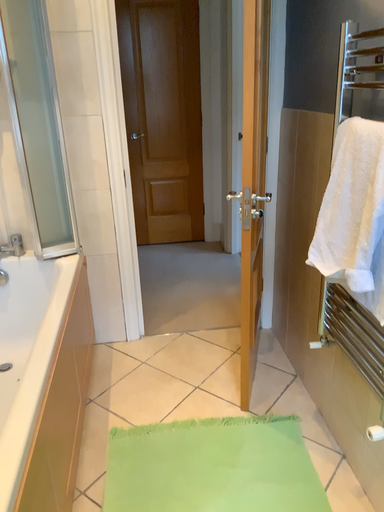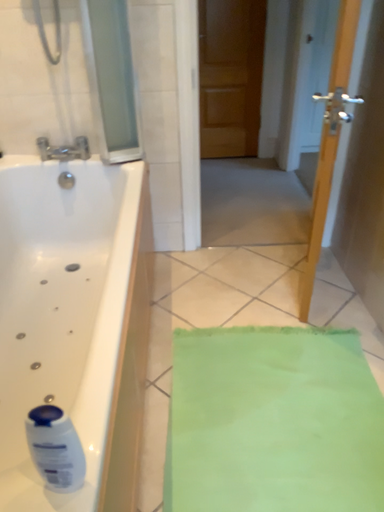
Question: Which way did the camera rotate in the video?

Choices:
 (A) rotated downward
 (B) rotated upward

Answer: (A)